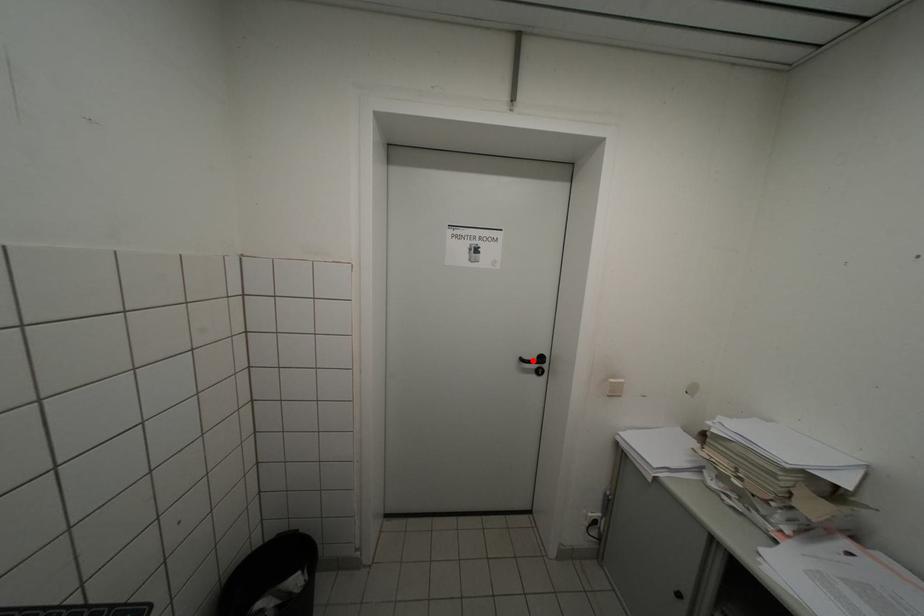
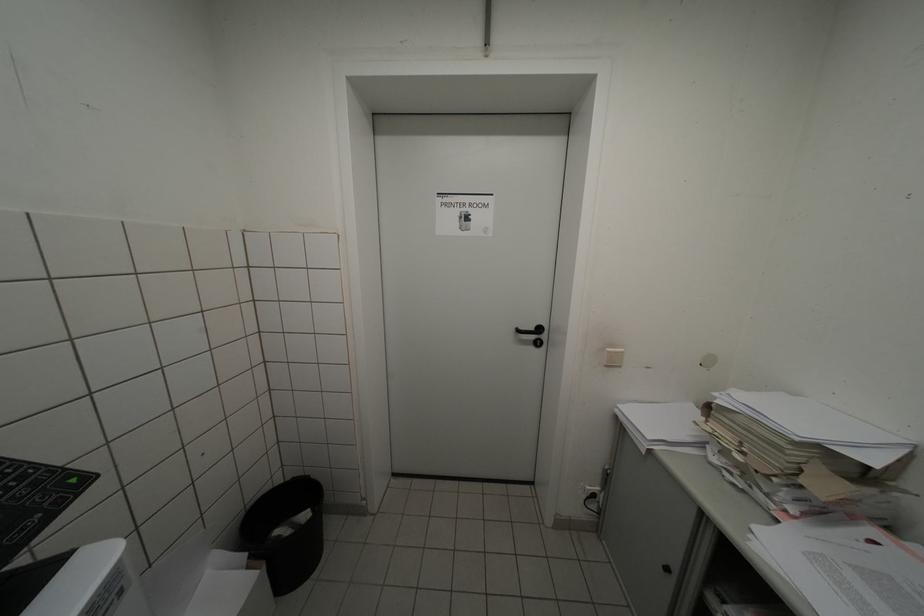
In the second image, find the point that corresponds to the highlighted location in the first image.

(529, 331)